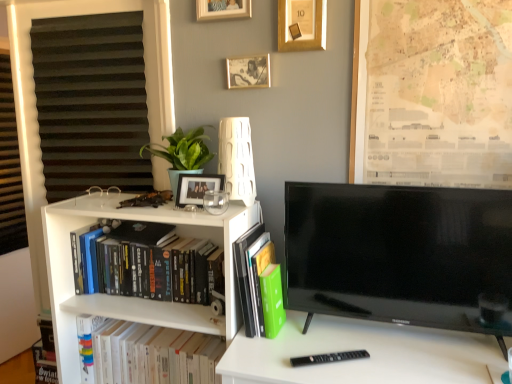
Question: Is wooden photo frame at upper center, placed as the third picture frame when sorted from top to bottom, smaller than green matte plant at upper left?

Choices:
 (A) yes
 (B) no

Answer: (A)

Question: Could you tell me if wooden photo frame at upper center, which appears as the 2th picture frame when ordered from the bottom, is turned towards green matte plant at upper left?

Choices:
 (A) no
 (B) yes

Answer: (A)

Question: Is wooden photo frame at upper center, placed as the third picture frame when sorted from top to bottom, positioned beyond the bounds of green matte plant at upper left?

Choices:
 (A) no
 (B) yes

Answer: (B)

Question: Would you consider wooden photo frame at upper center, placed as the third picture frame when sorted from top to bottom, to be distant from green matte plant at upper left?

Choices:
 (A) no
 (B) yes

Answer: (A)

Question: Is the depth of wooden photo frame at upper center, which appears as the 2th picture frame when ordered from the bottom, greater than that of green matte plant at upper left?

Choices:
 (A) no
 (B) yes

Answer: (B)

Question: Considering the positions of point (170, 178) and point (320, 31), is point (170, 178) closer or farther from the camera than point (320, 31)?

Choices:
 (A) closer
 (B) farther

Answer: (B)

Question: Is green matte plant at upper left inside the boundaries of gold metallic picture frame at upper center, placed as the third picture frame when sorted from bottom to top, or outside?

Choices:
 (A) outside
 (B) inside

Answer: (A)

Question: Is green matte plant at upper left in front of or behind gold metallic picture frame at upper center, which is the second picture frame from top to bottom, in the image?

Choices:
 (A) behind
 (B) front

Answer: (B)

Question: From the image's perspective, relative to gold metallic picture frame at upper center, which is the second picture frame from top to bottom, is green matte plant at upper left above or below?

Choices:
 (A) above
 (B) below

Answer: (B)

Question: In the image, is black glossy tv at right positioned in front of or behind green matte book at center, the second book from the top?

Choices:
 (A) behind
 (B) front

Answer: (B)

Question: From the image's perspective, is black glossy tv at right positioned above or below green matte book at center, the second book from the top?

Choices:
 (A) below
 (B) above

Answer: (B)

Question: Considering the positions of point (340, 215) and point (251, 317), is point (340, 215) closer or farther from the camera than point (251, 317)?

Choices:
 (A) farther
 (B) closer

Answer: (B)

Question: In terms of size, does black glossy tv at right appear bigger or smaller than green matte book at center, the second book from the top?

Choices:
 (A) small
 (B) big

Answer: (B)

Question: Looking at their shapes, would you say matte black picture frame at upper center, the first picture frame when ordered from bottom to top, is wider or thinner than black glossy tv at right?

Choices:
 (A) thin
 (B) wide

Answer: (A)

Question: From a real-world perspective, is matte black picture frame at upper center, the first picture frame when ordered from bottom to top, positioned above or below black glossy tv at right?

Choices:
 (A) below
 (B) above

Answer: (B)